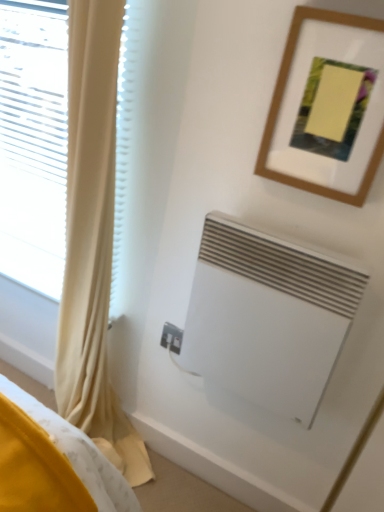
Question: Which direction should I rotate to look at white plastic electric outlet at lower center?

Choices:
 (A) left
 (B) right

Answer: (A)

Question: Is white plastic electric outlet at lower center positioned before yellow fabric curtain at left?

Choices:
 (A) no
 (B) yes

Answer: (A)

Question: From the image's perspective, is white plastic electric outlet at lower center on yellow fabric curtain at left?

Choices:
 (A) no
 (B) yes

Answer: (A)

Question: Is white plastic electric outlet at lower center completely or partially outside of yellow fabric curtain at left?

Choices:
 (A) yes
 (B) no

Answer: (A)

Question: Considering the relative sizes of white plastic electric outlet at lower center and yellow fabric curtain at left in the image provided, is white plastic electric outlet at lower center shorter than yellow fabric curtain at left?

Choices:
 (A) no
 (B) yes

Answer: (B)

Question: From the image's perspective, is white plastic electric outlet at lower center below yellow fabric curtain at left?

Choices:
 (A) yes
 (B) no

Answer: (A)

Question: Can you confirm if white plastic electric outlet at lower center is thinner than yellow fabric curtain at left?

Choices:
 (A) no
 (B) yes

Answer: (B)

Question: From the image's perspective, is yellow fabric curtain at left on top of white matte air conditioning at lower right?

Choices:
 (A) yes
 (B) no

Answer: (A)

Question: Is the position of yellow fabric curtain at left less distant than that of white matte air conditioning at lower right?

Choices:
 (A) yes
 (B) no

Answer: (A)

Question: From the image's perspective, does yellow fabric curtain at left appear lower than white matte air conditioning at lower right?

Choices:
 (A) yes
 (B) no

Answer: (B)

Question: Is the surface of yellow fabric curtain at left in direct contact with white matte air conditioning at lower right?

Choices:
 (A) yes
 (B) no

Answer: (B)

Question: Can you confirm if yellow fabric curtain at left is wider than white matte air conditioning at lower right?

Choices:
 (A) no
 (B) yes

Answer: (B)

Question: Can you confirm if yellow fabric curtain at left is smaller than white matte air conditioning at lower right?

Choices:
 (A) no
 (B) yes

Answer: (A)

Question: Is wooden picture frame at upper right positioned behind white matte air conditioning at lower right?

Choices:
 (A) yes
 (B) no

Answer: (B)